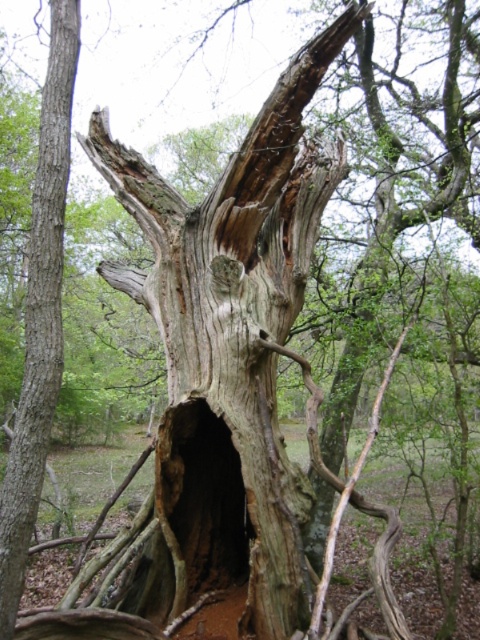
You are standing in the forest scene and want to reach both the point at coordinates point (68,118) and point (202,419). Which point should you head towards first if you want to reach the one closer to you first?

You should head towards point (68,118) first because it is closer to you than point (202,419).